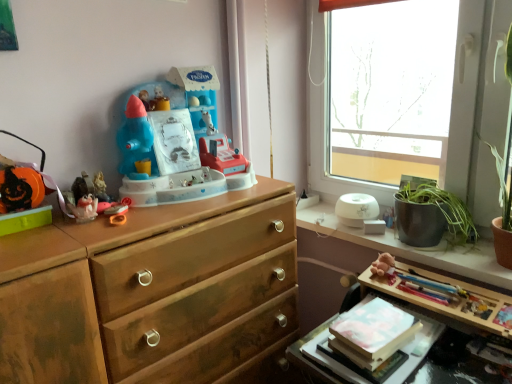
Question: Is brown plush toy at upper right facing towards plastic toy at center, acting as the fourth toy starting from the left?

Choices:
 (A) no
 (B) yes

Answer: (A)

Question: From the image's perspective, is brown plush toy at upper right under plastic toy at center, acting as the fourth toy starting from the left?

Choices:
 (A) no
 (B) yes

Answer: (B)

Question: From a real-world perspective, is brown plush toy at upper right physically above plastic toy at center, which is the first toy in right-to-left order?

Choices:
 (A) no
 (B) yes

Answer: (A)

Question: Is brown plush toy at upper right surrounding plastic toy at center, acting as the fourth toy starting from the left?

Choices:
 (A) no
 (B) yes

Answer: (A)

Question: Is brown plush toy at upper right turned away from plastic toy at center, which is the first toy in right-to-left order?

Choices:
 (A) no
 (B) yes

Answer: (A)

Question: Considering the relative positions of brown plush toy at upper right and plastic toy at center, acting as the fourth toy starting from the left, in the image provided, is brown plush toy at upper right to the left of plastic toy at center, acting as the fourth toy starting from the left, from the viewer's perspective?

Choices:
 (A) yes
 (B) no

Answer: (B)

Question: Can you confirm if wooden table at lower right is shorter than matte plastic toy at left, acting as the second toy starting from the left?

Choices:
 (A) no
 (B) yes

Answer: (A)

Question: Is wooden table at lower right at the right side of matte plastic toy at left, acting as the second toy starting from the left?

Choices:
 (A) no
 (B) yes

Answer: (B)

Question: From the image's perspective, would you say wooden table at lower right is positioned over matte plastic toy at left, acting as the second toy starting from the left?

Choices:
 (A) yes
 (B) no

Answer: (B)

Question: Does wooden table at lower right have a smaller size compared to matte plastic toy at left, acting as the second toy starting from the left?

Choices:
 (A) no
 (B) yes

Answer: (A)

Question: Can you confirm if wooden table at lower right is thinner than matte plastic toy at left, acting as the second toy starting from the left?

Choices:
 (A) no
 (B) yes

Answer: (A)

Question: Can you confirm if wooden table at lower right is taller than matte plastic toy at left, which is the 3th toy from right to left?

Choices:
 (A) no
 (B) yes

Answer: (B)

Question: Does white glossy humidifier at upper right have a greater width compared to transparent glass window at upper right?

Choices:
 (A) no
 (B) yes

Answer: (B)